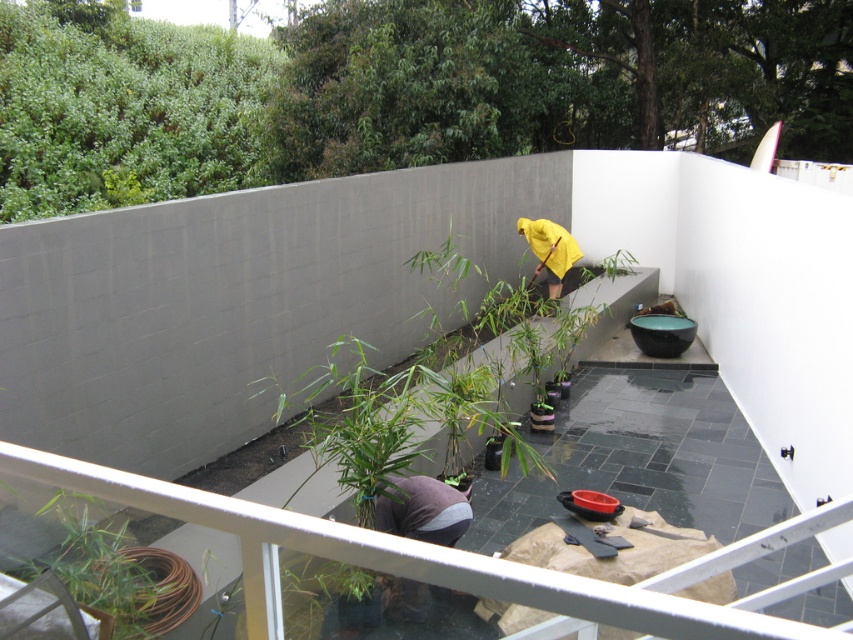
Question: Which point appears farthest from the camera in this image?

Choices:
 (A) (180, 566)
 (B) (426, 522)

Answer: (B)

Question: Observing the image, what is the correct spatial positioning of green leafy plant at upper center in reference to yellow fabric at center?

Choices:
 (A) left
 (B) right

Answer: (A)

Question: Which object is positioned farthest from the green leafy plant at upper center?

Choices:
 (A) green bamboo at lower left
 (B) gray fabric at lower center
 (C) yellow fabric at center

Answer: (B)

Question: Estimate the real-world distances between objects in this image. Which object is closer to the gray fabric at lower center?

Choices:
 (A) green bamboo at lower left
 (B) yellow fabric at center
 (C) green leafy plant at upper center

Answer: (A)

Question: Considering the relative positions of green leafy plant at upper center and gray fabric at lower center in the image provided, where is green leafy plant at upper center located with respect to gray fabric at lower center?

Choices:
 (A) above
 (B) below

Answer: (A)

Question: Is green leafy plant at upper center to the left of gray fabric at lower center from the viewer's perspective?

Choices:
 (A) no
 (B) yes

Answer: (B)